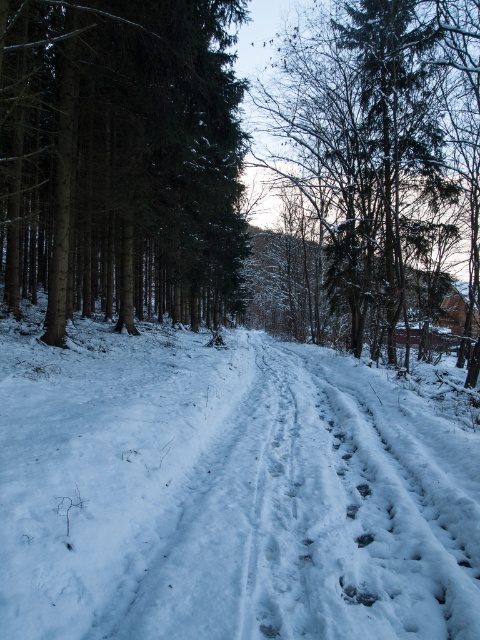
Question: Which point appears closest to the camera in this image?

Choices:
 (A) (425, 154)
 (B) (132, 205)

Answer: (B)

Question: Which point is closer to the camera?

Choices:
 (A) green matte tree at left
 (B) snow-covered tree at center

Answer: (A)

Question: Can you confirm if green matte tree at left is positioned above snow-covered tree at center?

Choices:
 (A) yes
 (B) no

Answer: (B)

Question: Can you confirm if green matte tree at left is bigger than snow-covered tree at center?

Choices:
 (A) no
 (B) yes

Answer: (A)

Question: Can you confirm if green matte tree at left is bigger than snow-covered tree at center?

Choices:
 (A) yes
 (B) no

Answer: (B)